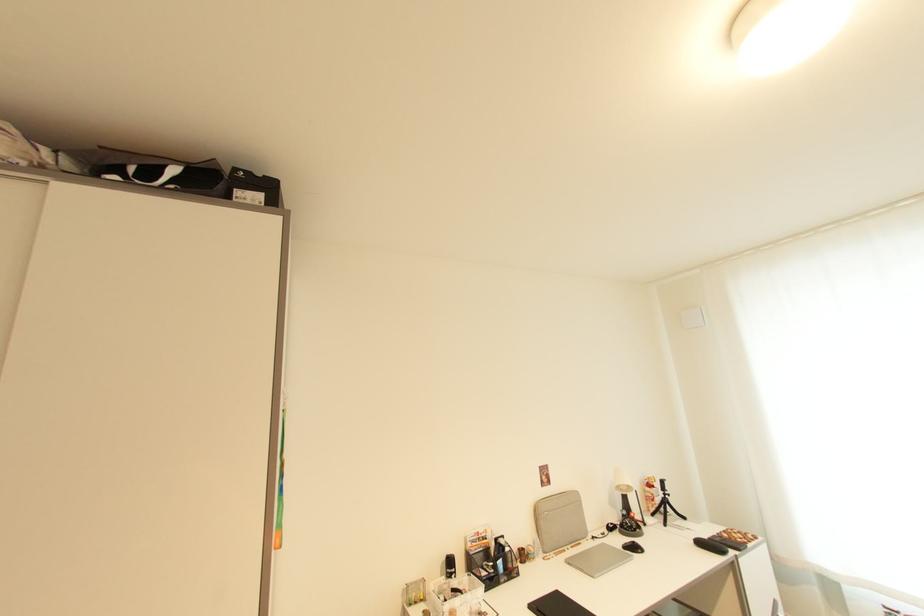
Identify the location of black electronic tablet. This screenshot has height=616, width=924. (556, 605).